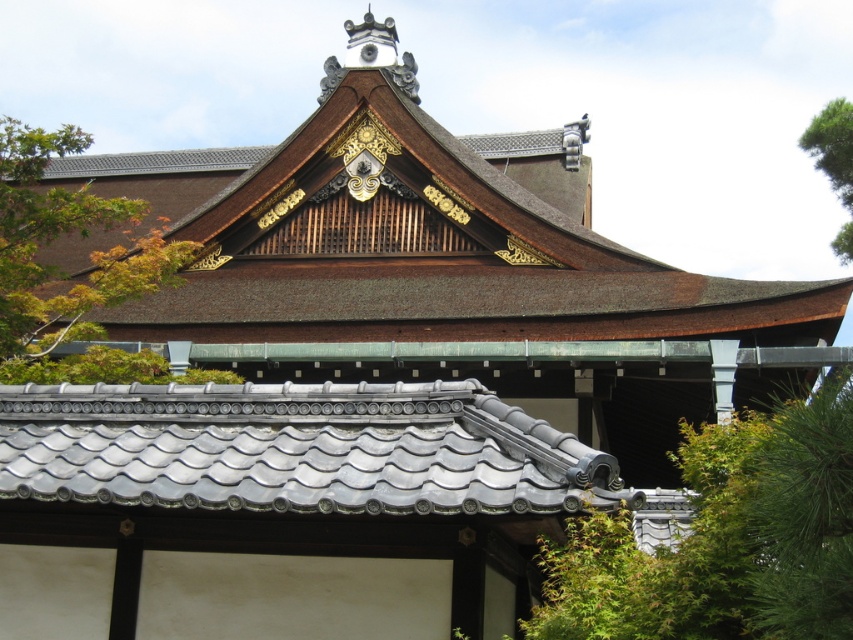
Who is lower down, brown tile roof at upper center or green leafy tree at upper right?

brown tile roof at upper center

How much distance is there between brown tile roof at upper center and green leafy tree at upper right?

26.85 meters

The height and width of the screenshot is (640, 853). I want to click on brown tile roof at upper center, so click(x=415, y=237).

Is gray tile roof at center smaller than green leafy tree at upper right?

Indeed, gray tile roof at center has a smaller size compared to green leafy tree at upper right.

Between point (152, 440) and point (848, 237), which one is positioned behind?

The point (848, 237) is more distant.

Identify the location of gray tile roof at center. The width and height of the screenshot is (853, 640). (302, 449).

Where is `gray tile roof at center`? gray tile roof at center is located at coordinates (302, 449).

Can you confirm if brown tile roof at upper center is positioned below gray tile roof at center?

No.

Does point (195, 284) lie behind point (581, 490)?

Yes, it is behind point (581, 490).

Locate an element on the screen. The image size is (853, 640). brown tile roof at upper center is located at coordinates (415, 237).